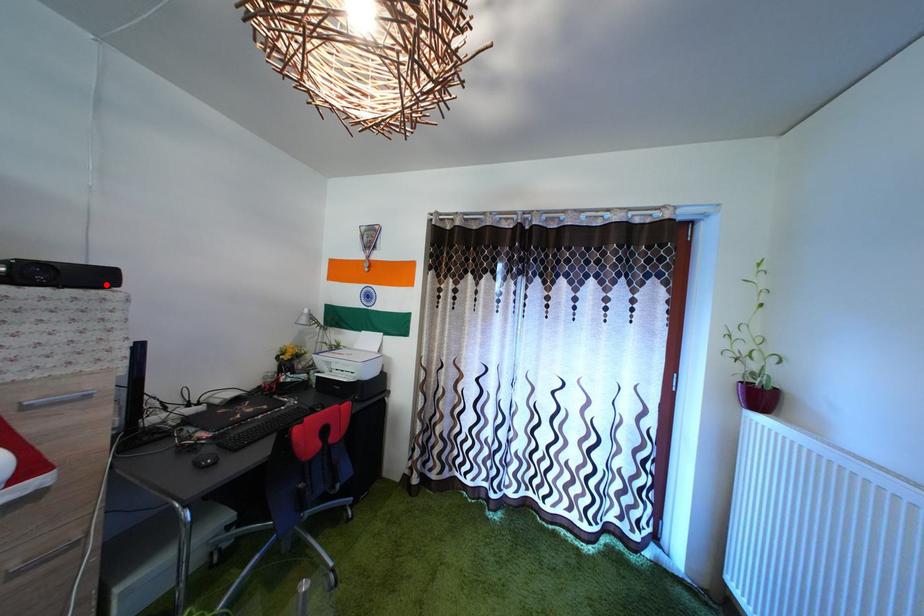
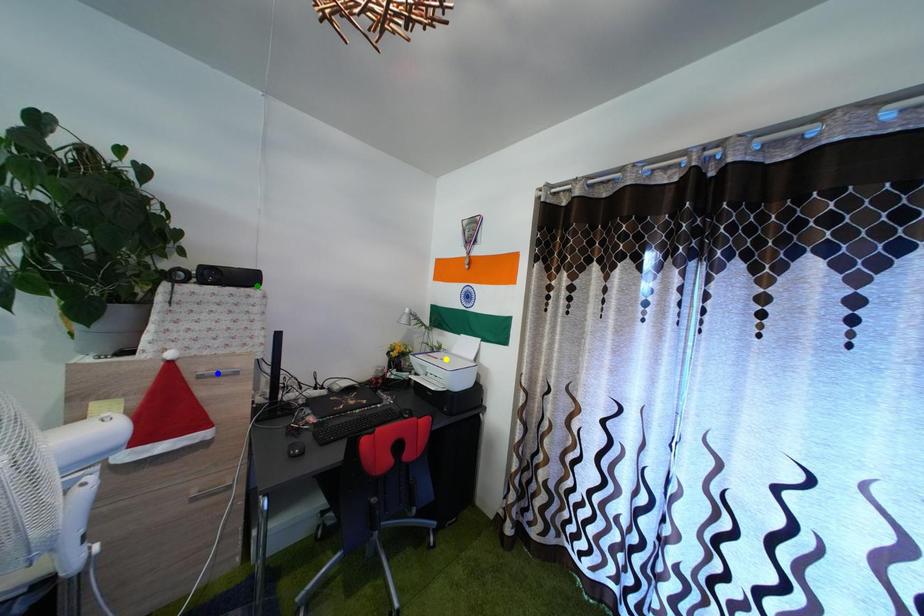
Question: I am providing you with two images of the same scene from different viewpoints. A red point is marked on the first image. You are given multiple points on the second image. Which point in image 2 represents the same 3d spot as the red point in image 1?

Choices:
 (A) yellow point
 (B) blue point
 (C) green point

Answer: (C)